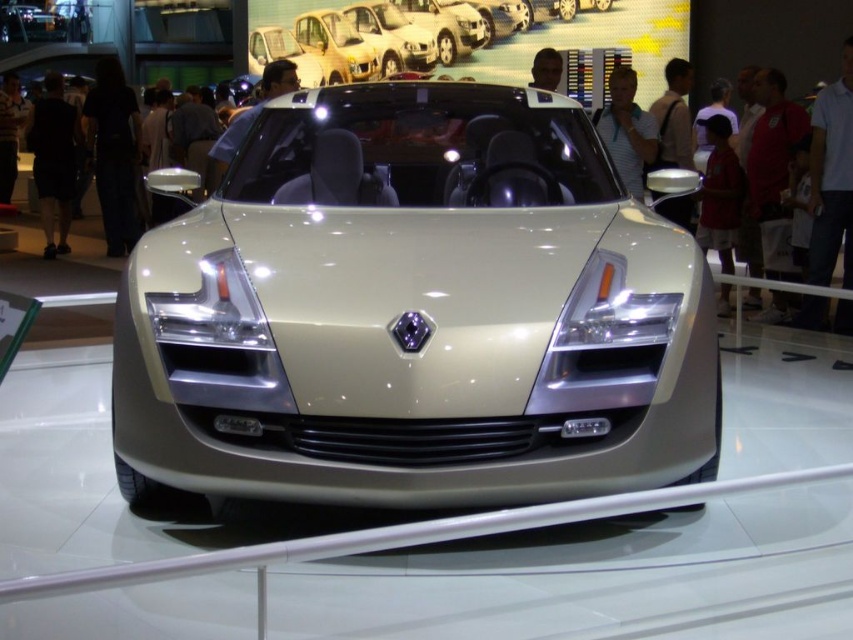
Is metallic silver car at center to the left of satin silver car at upper center from the viewer's perspective?

Yes, metallic silver car at center is to the left of satin silver car at upper center.

How far apart are metallic silver car at center and satin silver car at upper center?

metallic silver car at center and satin silver car at upper center are 9.84 meters apart.

Measure the distance between metallic silver car at center and camera.

metallic silver car at center is 7.40 feet away from camera.

Find the location of a particular element. This screenshot has width=853, height=640. metallic silver car at center is located at coordinates (415, 314).